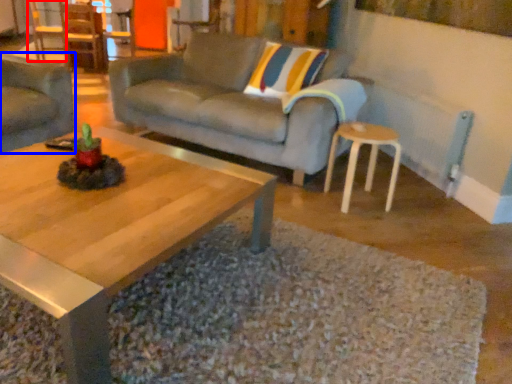
Question: Which object appears closest to the camera in this image, chair (highlighted by a red box) or studio couch (highlighted by a blue box)?

Choices:
 (A) chair
 (B) studio couch

Answer: (B)